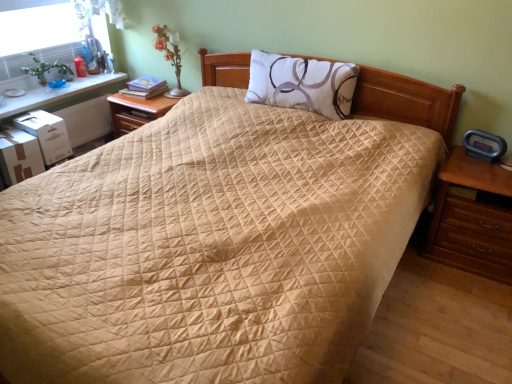
Question: From the image's perspective, is white matte pillow at center beneath wooden nightstand at center-left, the second nightstand when ordered from front to back?

Choices:
 (A) yes
 (B) no

Answer: (B)

Question: Does white matte pillow at center lie in front of wooden nightstand at center-left, the second nightstand when ordered from front to back?

Choices:
 (A) no
 (B) yes

Answer: (B)

Question: Is white matte pillow at center far away from wooden nightstand at center-left, which ranks as the second nightstand in right-to-left order?

Choices:
 (A) yes
 (B) no

Answer: (B)

Question: Is white matte pillow at center at the left side of wooden nightstand at center-left, the second nightstand when ordered from front to back?

Choices:
 (A) no
 (B) yes

Answer: (A)

Question: Could wooden nightstand at center-left, which ranks as the first nightstand in back-to-front order, be considered to be inside white matte pillow at center?

Choices:
 (A) yes
 (B) no

Answer: (B)

Question: Considering the positions of point (47, 97) and point (145, 117), is point (47, 97) closer or farther from the camera than point (145, 117)?

Choices:
 (A) closer
 (B) farther

Answer: (A)

Question: Looking at their shapes, would you say white glossy table at upper left is wider or thinner than wooden nightstand at center-left, which is the second nightstand from bottom to top?

Choices:
 (A) wide
 (B) thin

Answer: (B)

Question: From the image's perspective, is white glossy table at upper left located above or below wooden nightstand at center-left, which ranks as the first nightstand in back-to-front order?

Choices:
 (A) above
 (B) below

Answer: (A)

Question: From a real-world perspective, relative to wooden nightstand at center-left, which ranks as the first nightstand in back-to-front order, is white glossy table at upper left vertically above or below?

Choices:
 (A) above
 (B) below

Answer: (A)

Question: From a real-world perspective, is brown wooden nightstand at right, arranged as the first nightstand when viewed from the front, physically located above or below matte white glass table lamp at upper left?

Choices:
 (A) below
 (B) above

Answer: (A)

Question: Is brown wooden nightstand at right, which ranks as the 2th nightstand in left-to-right order, bigger or smaller than matte white glass table lamp at upper left?

Choices:
 (A) small
 (B) big

Answer: (B)

Question: Considering their positions, is brown wooden nightstand at right, the first nightstand when ordered from bottom to top, located in front of or behind matte white glass table lamp at upper left?

Choices:
 (A) behind
 (B) front

Answer: (B)

Question: Is brown wooden nightstand at right, arranged as the 2th nightstand when viewed from the back, inside or outside of matte white glass table lamp at upper left?

Choices:
 (A) inside
 (B) outside

Answer: (B)

Question: Is brown wooden nightstand at right, which appears as the 1th nightstand when viewed from the right, spatially inside white glossy table at upper left, or outside of it?

Choices:
 (A) inside
 (B) outside

Answer: (B)

Question: Considering the positions of brown wooden nightstand at right, the first nightstand when ordered from bottom to top, and white glossy table at upper left in the image, is brown wooden nightstand at right, the first nightstand when ordered from bottom to top, bigger or smaller than white glossy table at upper left?

Choices:
 (A) big
 (B) small

Answer: (A)